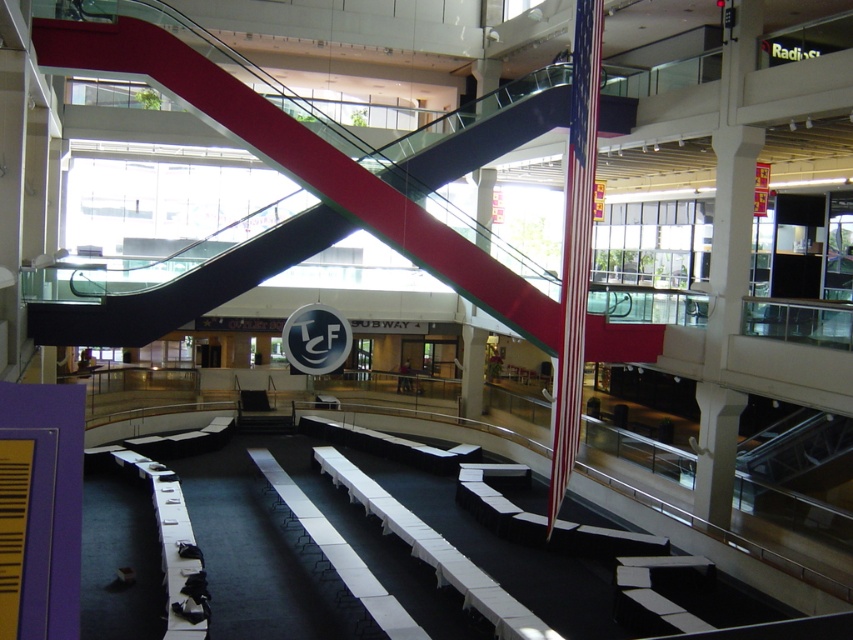
Is metallic escalator at center shorter than red and white striped pole at center?

In fact, metallic escalator at center may be taller than red and white striped pole at center.

This screenshot has height=640, width=853. Identify the location of metallic escalator at center. (189, 285).

I want to click on metallic escalator at center, so click(x=189, y=285).